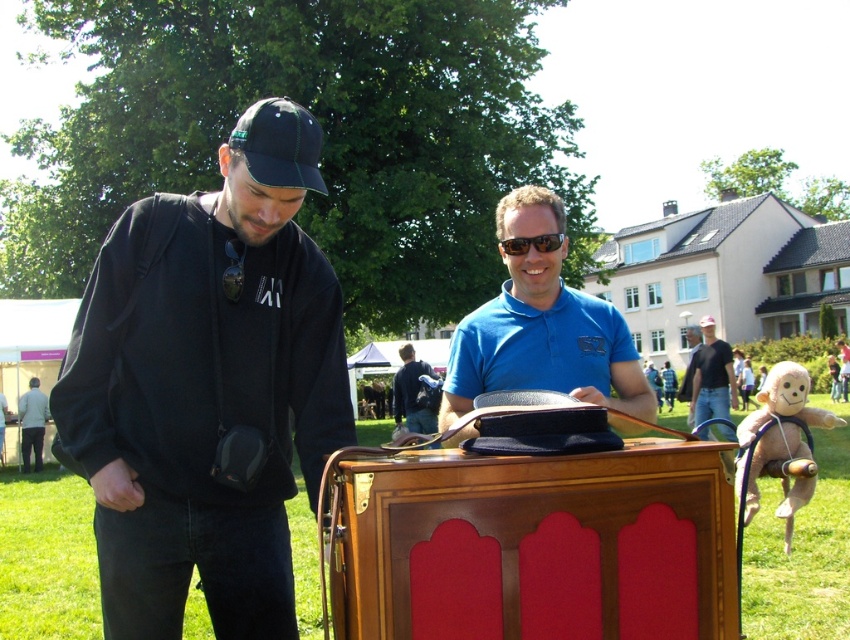
Question: Does plush beige monkey at lower right appear on the right side of blue smooth shirt at center?

Choices:
 (A) yes
 (B) no

Answer: (B)

Question: In this image, where is green fabric baseball cap at upper left located relative to dark blue shirt at center?

Choices:
 (A) below
 (B) above

Answer: (B)

Question: Does black matte jacket at left have a lesser width compared to dark blue shirt at center?

Choices:
 (A) no
 (B) yes

Answer: (A)

Question: Which point is closer to the camera taking this photo?

Choices:
 (A) (717, 392)
 (B) (828, 420)
 (C) (298, 132)
 (D) (26, 451)

Answer: (C)

Question: Which of these objects is positioned farthest from the blue matte shirt at center?

Choices:
 (A) black plastic sunglasses at center
 (B) blue smooth shirt at center

Answer: (B)

Question: Which point appears farthest from the camera in this image?

Choices:
 (A) (408, 428)
 (B) (276, 125)

Answer: (A)